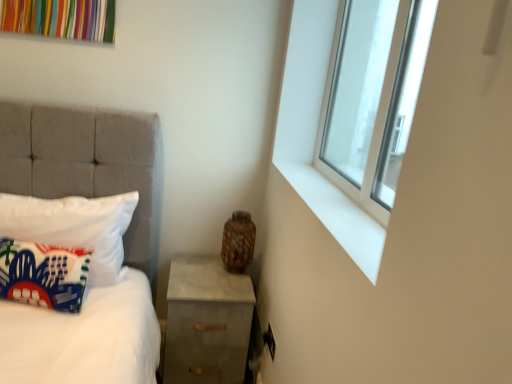
What do you see at coordinates (42, 274) in the screenshot?
I see `printed fabric pillow at left, the second pillow when ordered from back to front` at bounding box center [42, 274].

What is the approximate height of concrete nightstand at lower right?

concrete nightstand at lower right is 19.99 inches in height.

Image resolution: width=512 pixels, height=384 pixels. What do you see at coordinates (206, 322) in the screenshot?
I see `concrete nightstand at lower right` at bounding box center [206, 322].

The height and width of the screenshot is (384, 512). I want to click on white fabric pillow at left, arranged as the second pillow when viewed from the front, so click(x=74, y=227).

From a real-world perspective, which is physically above, white fabric pillow at left, which is the 1th pillow from back to front, or printed fabric pillow at left, which is the 1th pillow in front-to-back order?

white fabric pillow at left, which is the 1th pillow from back to front, is physically above.

Does white fabric pillow at left, arranged as the second pillow when viewed from the front, lie in front of printed fabric pillow at left, which is the 1th pillow in front-to-back order?

That is False.

Is white fabric pillow at left, which is the 1th pillow from back to front, located outside printed fabric pillow at left, the second pillow when ordered from back to front?

Yes, white fabric pillow at left, which is the 1th pillow from back to front, is not within printed fabric pillow at left, the second pillow when ordered from back to front.

Is white fabric pillow at left, which is the 1th pillow from back to front, next to printed fabric pillow at left, the second pillow when ordered from back to front?

No, white fabric pillow at left, which is the 1th pillow from back to front, is not in contact with printed fabric pillow at left, the second pillow when ordered from back to front.

Considering the sizes of objects brown textured vase at lower right and clear glass window at upper right in the image provided, who is taller, brown textured vase at lower right or clear glass window at upper right?

clear glass window at upper right.

Is brown textured vase at lower right in front of or behind clear glass window at upper right in the image?

Visually, brown textured vase at lower right is located behind clear glass window at upper right.

Can you confirm if brown textured vase at lower right is positioned to the right of clear glass window at upper right?

No, brown textured vase at lower right is not to the right of clear glass window at upper right.

From a real-world perspective, is brown textured vase at lower right physically located above or below clear glass window at upper right?

From a real-world perspective, brown textured vase at lower right is physically below clear glass window at upper right.

Considering the relative sizes of clear glass window at upper right and concrete nightstand at lower right in the image provided, is clear glass window at upper right thinner than concrete nightstand at lower right?

Correct, the width of clear glass window at upper right is less than that of concrete nightstand at lower right.

Can you see clear glass window at upper right touching concrete nightstand at lower right?

No, clear glass window at upper right is not next to concrete nightstand at lower right.

Looking at this image, which of these two, clear glass window at upper right or concrete nightstand at lower right, stands taller?

clear glass window at upper right.

From the image's perspective, between clear glass window at upper right and concrete nightstand at lower right, who is located below?

concrete nightstand at lower right is shown below in the image.

Are concrete nightstand at lower right and white smooth window sill at upper right far apart?

Actually, concrete nightstand at lower right and white smooth window sill at upper right are a little close together.

Is concrete nightstand at lower right closer to the viewer compared to white smooth window sill at upper right?

No, it is behind white smooth window sill at upper right.

Would you say concrete nightstand at lower right is inside or outside white smooth window sill at upper right?

concrete nightstand at lower right is not enclosed by white smooth window sill at upper right.

Which of these two, clear glass window at upper right or white fabric pillow at left, which is the 1th pillow from back to front, stands taller?

clear glass window at upper right.

What's the angular difference between clear glass window at upper right and white fabric pillow at left, arranged as the second pillow when viewed from the front,'s facing directions?

88.7 degrees.

Is clear glass window at upper right directly adjacent to white fabric pillow at left, which is the 1th pillow from back to front?

There is a gap between clear glass window at upper right and white fabric pillow at left, which is the 1th pillow from back to front.

From the image's perspective, would you say clear glass window at upper right is shown under white fabric pillow at left, which is the 1th pillow from back to front?

No.

Considering the sizes of objects white smooth window sill at upper right and white fabric pillow at left, which is the 1th pillow from back to front, in the image provided, who is thinner, white smooth window sill at upper right or white fabric pillow at left, which is the 1th pillow from back to front,?

Thinner between the two is white smooth window sill at upper right.

How many degrees apart are the facing directions of white smooth window sill at upper right and white fabric pillow at left, arranged as the second pillow when viewed from the front?

There is a 89.5-degree angle between the facing directions of white smooth window sill at upper right and white fabric pillow at left, arranged as the second pillow when viewed from the front.

Relative to white fabric pillow at left, which is the 1th pillow from back to front, is white smooth window sill at upper right in front or behind?

In the image, white smooth window sill at upper right appears in front of white fabric pillow at left, which is the 1th pillow from back to front.

Is white fabric pillow at left, arranged as the second pillow when viewed from the front, surrounded by white smooth window sill at upper right?

No, white fabric pillow at left, arranged as the second pillow when viewed from the front, is not surrounded by white smooth window sill at upper right.

Could you tell me if clear glass window at upper right is turned towards white smooth window sill at upper right?

Yes, clear glass window at upper right is turned towards white smooth window sill at upper right.

Is clear glass window at upper right inside or outside of white smooth window sill at upper right?

clear glass window at upper right lies outside white smooth window sill at upper right.

From a real-world perspective, is clear glass window at upper right physically located above or below white smooth window sill at upper right?

In terms of real-world spatial position, clear glass window at upper right is above white smooth window sill at upper right.

You are a GUI agent. You are given a task and a screenshot of the screen. Output one action in this format:
    pyautogui.click(x=<x>, y=<y>)
    Task: Click on the pillow located above the printed fabric pillow at left, the second pillow when ordered from back to front (from a real-world perspective)
    Image resolution: width=512 pixels, height=384 pixels.
    Given the screenshot: What is the action you would take?
    pyautogui.click(x=74, y=227)

This screenshot has height=384, width=512. Identify the location of vase below the clear glass window at upper right (from the image's perspective). (238, 242).

Looking at the image, which one is located further to printed fabric pillow at left, the second pillow when ordered from back to front, brown textured vase at lower right or concrete nightstand at lower right?

brown textured vase at lower right.

Which object lies nearer to the anchor point white smooth window sill at upper right, clear glass window at upper right or white fabric pillow at left, arranged as the second pillow when viewed from the front?

clear glass window at upper right is closer to white smooth window sill at upper right.

Considering their positions, is brown textured vase at lower right positioned closer to white smooth window sill at upper right than clear glass window at upper right?

Based on the image, clear glass window at upper right appears to be nearer to white smooth window sill at upper right.

Based on their spatial positions, is white fabric pillow at left, arranged as the second pillow when viewed from the front, or white smooth window sill at upper right closer to brown textured vase at lower right?

Based on the image, white fabric pillow at left, arranged as the second pillow when viewed from the front, appears to be nearer to brown textured vase at lower right.

Looking at the image, which one is located closer to brown textured vase at lower right, clear glass window at upper right or printed fabric pillow at left, the second pillow when ordered from back to front?

Based on the image, clear glass window at upper right appears to be nearer to brown textured vase at lower right.

In the scene shown: Looking at the image, which one is located closer to clear glass window at upper right, printed fabric pillow at left, the second pillow when ordered from back to front, or concrete nightstand at lower right?

Among the two, concrete nightstand at lower right is located nearer to clear glass window at upper right.

Based on their spatial positions, is brown textured vase at lower right or white smooth window sill at upper right further from white fabric pillow at left, arranged as the second pillow when viewed from the front?

Based on the image, white smooth window sill at upper right appears to be further to white fabric pillow at left, arranged as the second pillow when viewed from the front.

Based on their spatial positions, is brown textured vase at lower right or white smooth window sill at upper right further from clear glass window at upper right?

brown textured vase at lower right.

Where is `pillow between printed fabric pillow at left, which is the 1th pillow in front-to-back order, and white smooth window sill at upper right, in the horizontal direction`? Image resolution: width=512 pixels, height=384 pixels. pillow between printed fabric pillow at left, which is the 1th pillow in front-to-back order, and white smooth window sill at upper right, in the horizontal direction is located at coordinates tap(74, 227).

The width and height of the screenshot is (512, 384). Identify the location of nightstand between white fabric pillow at left, arranged as the second pillow when viewed from the front, and clear glass window at upper right, in the horizontal direction. (206, 322).

Find the location of `vase between printed fabric pillow at left, which is the 1th pillow in front-to-back order, and white smooth window sill at upper right, in the horizontal direction`. vase between printed fabric pillow at left, which is the 1th pillow in front-to-back order, and white smooth window sill at upper right, in the horizontal direction is located at coordinates (238, 242).

At what (x,y) coordinates should I click in order to perform the action: click on pillow located between printed fabric pillow at left, the second pillow when ordered from back to front, and concrete nightstand at lower right in the left-right direction. Please return your answer as a coordinate pair (x, y). The image size is (512, 384). Looking at the image, I should click on (74, 227).